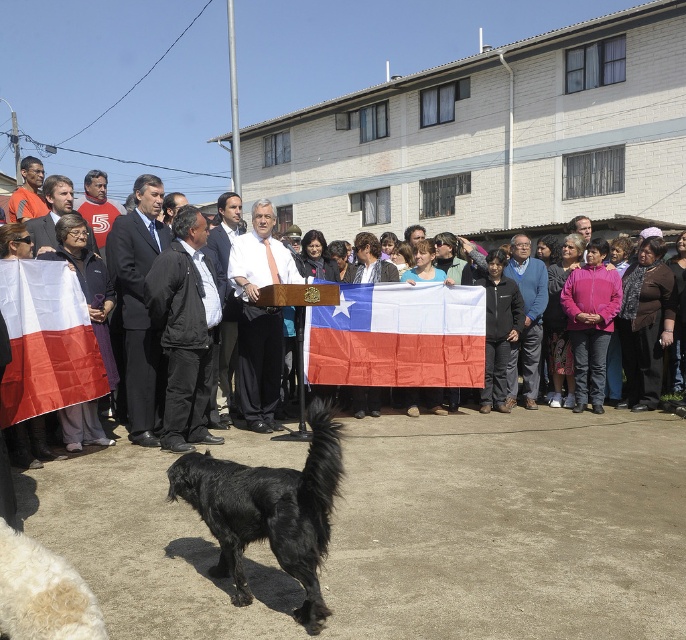
Is matte black dog at lower center further to the viewer compared to matte black suit at center?

No, matte black dog at lower center is in front of matte black suit at center.

Is point (119, 234) farther from viewer compared to point (45, 225)?

No.

Between point (40, 449) and point (49, 237), which one is positioned behind?

Point (49, 237)

Where is `matte black dog at lower center`? matte black dog at lower center is located at coordinates (139, 406).

Does point (123, 320) come in front of point (93, 417)?

No.

Does dark suit at center have a smaller size compared to matte black dog at lower center?

Yes.

Is point (134, 339) less distant than point (113, 227)?

Yes, it is.

Find the location of a particular element. This screenshot has height=640, width=686. dark suit at center is located at coordinates (139, 304).

Does matte black dog at lower center have a lesser height compared to matte red shirt at center?

In fact, matte black dog at lower center may be taller than matte red shirt at center.

Find the location of `matte black dog at lower center`. matte black dog at lower center is located at coordinates (139, 406).

Image resolution: width=686 pixels, height=640 pixels. I want to click on matte black dog at lower center, so click(139, 406).